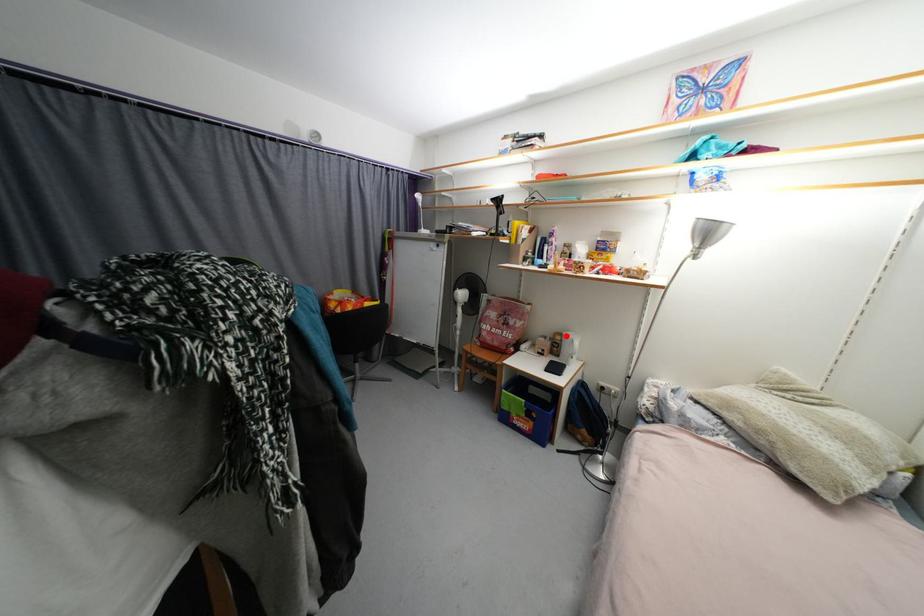
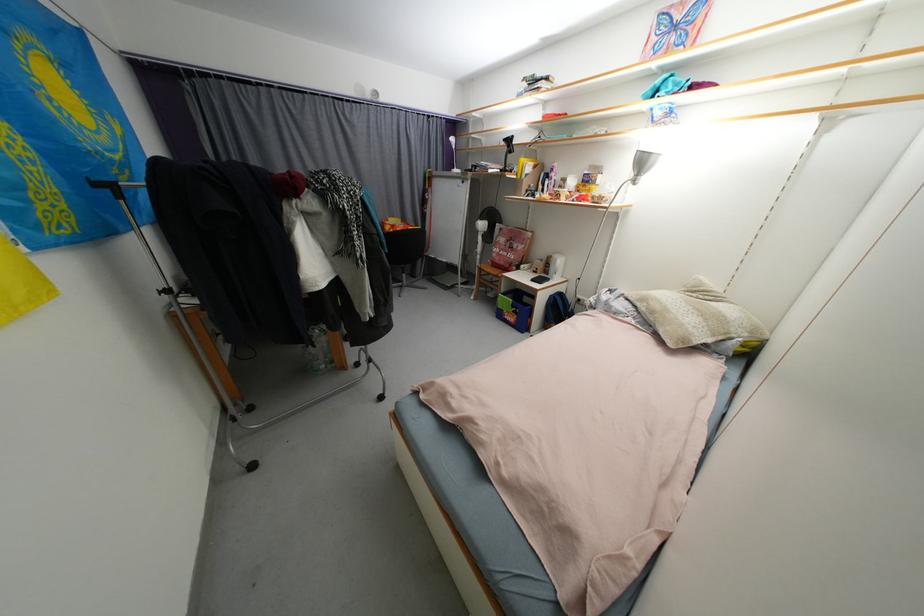
Question: I am providing you with two images of the same scene from different viewpoints. In image1, a red point is highlighted. Considering the same 3D point in image2, which of the following is correct?

Choices:
 (A) It is closer
 (B) It is farther

Answer: (A)